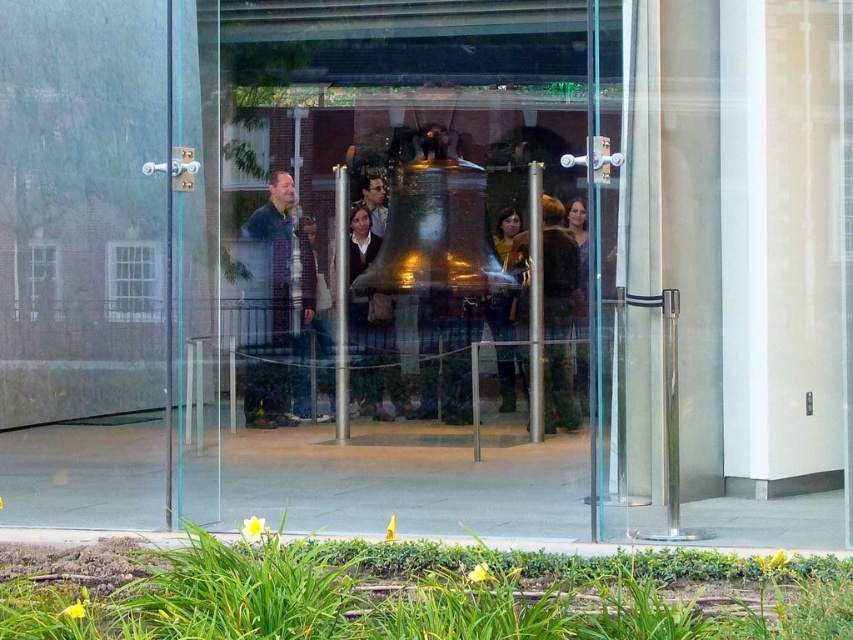
You are standing in front of the transparent glass door at center and the brown leather jacket at center. Which object is positioned to the left from your perspective?

The transparent glass door at center is positioned to the left of the brown leather jacket at center.

You are standing in front of the transparent glass door at center. To your left, there is a brick building with white windows reflected in the door. Can you determine if the brick building is actually to your left or if it appears that way due to the door reflection?

The transparent glass door at center reflects the brick building with white windows, so the building is actually to your left as the reflection shows the real environment around the door.

In the scene shown: You are a visitor at the exhibit and want to enter through the transparent glass door at center. However, you notice a dark brown leather jacket at center blocking your path. Can you walk through the door without moving the jacket?

The transparent glass door at center is not as tall as dark brown leather jacket at center, meaning the jacket is taller than the door. Since the jacket is blocking the path, you cannot walk through the door without moving the jacket.